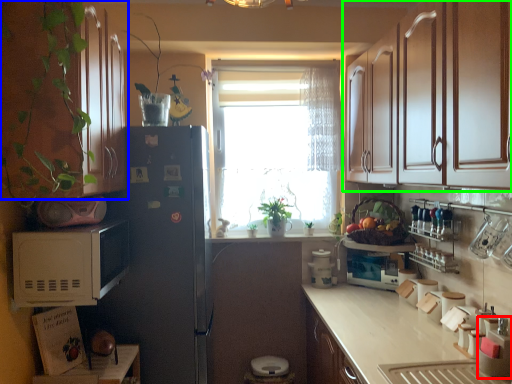
Question: Based on their relative distances, which object is nearer to appliance (highlighted by a red box)? Choose from cabinetry (highlighted by a blue box) and cabinetry (highlighted by a green box).

Choices:
 (A) cabinetry
 (B) cabinetry

Answer: (B)